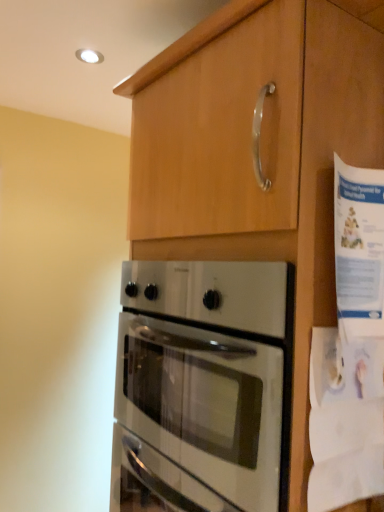
Question: Is matte wood cabinet at upper center completely or partially inside white paper at right?

Choices:
 (A) no
 (B) yes

Answer: (A)

Question: From a real-world perspective, does white paper at right sit lower than matte wood cabinet at upper center?

Choices:
 (A) yes
 (B) no

Answer: (B)

Question: From the image's perspective, does white paper at right appear higher than matte wood cabinet at upper center?

Choices:
 (A) yes
 (B) no

Answer: (A)

Question: From a real-world perspective, does white paper at right stand above matte wood cabinet at upper center?

Choices:
 (A) yes
 (B) no

Answer: (A)

Question: Is white paper at right not close to matte wood cabinet at upper center?

Choices:
 (A) yes
 (B) no

Answer: (B)

Question: Is the position of white paper at right less distant than that of matte wood cabinet at upper center?

Choices:
 (A) yes
 (B) no

Answer: (B)

Question: From the image's perspective, is matte wood cabinet at upper center on satin silver oven at center?

Choices:
 (A) no
 (B) yes

Answer: (B)

Question: Can you confirm if matte wood cabinet at upper center is smaller than satin silver oven at center?

Choices:
 (A) yes
 (B) no

Answer: (B)

Question: Does matte wood cabinet at upper center have a greater height compared to satin silver oven at center?

Choices:
 (A) no
 (B) yes

Answer: (B)

Question: Can you confirm if matte wood cabinet at upper center is wider than satin silver oven at center?

Choices:
 (A) yes
 (B) no

Answer: (B)

Question: From a real-world perspective, is matte wood cabinet at upper center on top of satin silver oven at center?

Choices:
 (A) no
 (B) yes

Answer: (B)

Question: Is matte wood cabinet at upper center further to the viewer compared to satin silver oven at center?

Choices:
 (A) no
 (B) yes

Answer: (A)

Question: Is satin silver oven at center behind white paper at right?

Choices:
 (A) yes
 (B) no

Answer: (B)